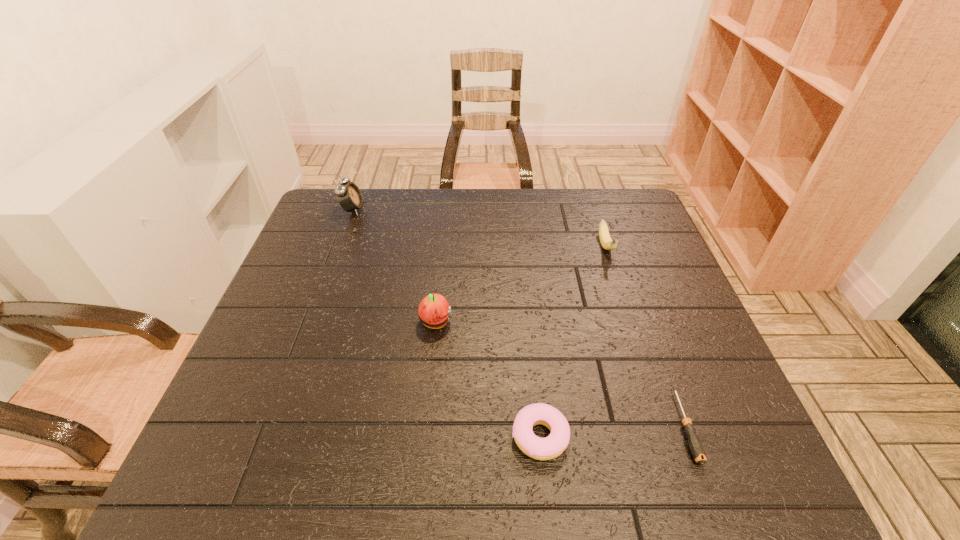
You are a GUI agent. You are given a task and a screenshot of the screen. Output one action in this format:
    pyautogui.click(x=<x>, y=<y>)
    Task: Click on the tallest object
    The image size is (960, 540).
    Given the screenshot: What is the action you would take?
    pyautogui.click(x=349, y=196)

Where is `the leftmost object`? the leftmost object is located at coordinates (349, 196).

Find the location of a particular element. Image resolution: width=960 pixels, height=540 pixels. the fourth object from right to left is located at coordinates (434, 311).

In order to click on the third farthest object in this screenshot , I will do `click(434, 311)`.

Find the location of a particular element. The height and width of the screenshot is (540, 960). the second object from right to left is located at coordinates (607, 243).

At what (x,y) coordinates should I click in order to perform the action: click on the fourth nearest object. Please return your answer as a coordinate pair (x, y). Looking at the image, I should click on (607, 243).

Locate an element on the screen. Image resolution: width=960 pixels, height=540 pixels. doughnut is located at coordinates (552, 446).

Identify the location of the third object from right to left. The image size is (960, 540). (552, 446).

At what (x,y) coordinates should I click in order to perform the action: click on the rightmost object. Please return your answer as a coordinate pair (x, y). The height and width of the screenshot is (540, 960). Looking at the image, I should click on (696, 447).

The height and width of the screenshot is (540, 960). I want to click on screwdriver, so click(x=696, y=447).